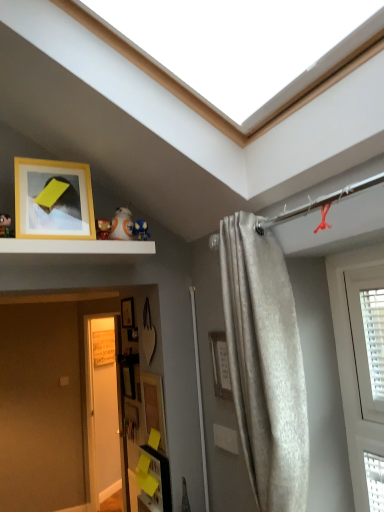
Measure the distance between wooden picture frame at lower center, which is the 2th picture frame from back to front, and camera.

They are 3.20 meters apart.

What do you see at coordinates (5, 226) in the screenshot? The width and height of the screenshot is (384, 512). I see `matte black toy at upper left, marked as the fourth toy in a back-to-front arrangement` at bounding box center [5, 226].

The width and height of the screenshot is (384, 512). I want to click on white glossy door at lower left, so click(x=92, y=389).

From the image's perspective, is white glossy bb8 droid at upper center, which is the 3th toy from left to right, above or below white matte shelf at upper center?

white glossy bb8 droid at upper center, which is the 3th toy from left to right, is above white matte shelf at upper center.

Considering their positions, is white glossy bb8 droid at upper center, which is the 3th toy from left to right, located in front of or behind white matte shelf at upper center?

white glossy bb8 droid at upper center, which is the 3th toy from left to right, is positioned farther from the viewer than white matte shelf at upper center.

Which is closer to the camera, (126, 233) or (82, 250)?

Point (126, 233).

Measure the distance from white glossy bb8 droid at upper center, which ranks as the 2th toy in right-to-left order, to white matte shelf at upper center.

The distance of white glossy bb8 droid at upper center, which ranks as the 2th toy in right-to-left order, from white matte shelf at upper center is 5.23 inches.

I want to click on picture frame above the wooden picture frame at center, placed as the fourth picture frame when sorted from front to back (from a real-world perspective), so click(x=53, y=200).

Is yellow matte picture frame at upper left, the first picture frame viewed from the front, inside or outside of wooden picture frame at center, the third picture frame from the bottom?

yellow matte picture frame at upper left, the first picture frame viewed from the front, cannot be found inside wooden picture frame at center, the third picture frame from the bottom.

What's the angular difference between yellow matte picture frame at upper left, the first picture frame viewed from the front, and wooden picture frame at center, placed as the fourth picture frame when sorted from front to back,'s facing directions?

The angle between the facing direction of yellow matte picture frame at upper left, the first picture frame viewed from the front, and the facing direction of wooden picture frame at center, placed as the fourth picture frame when sorted from front to back, is 88.5 degrees.

Between yellow matte picture frame at upper left, which ranks as the fourth picture frame in bottom-to-top order, and wooden picture frame at center, placed as the fourth picture frame when sorted from front to back, which one has less height?

With less height is wooden picture frame at center, placed as the fourth picture frame when sorted from front to back.

From a real-world perspective, which object stands above the other?

white glossy bb8 droid at upper center, which ranks as the 2th toy in right-to-left order, from a real-world perspective.

Is matte blue plush at upper center, marked as the 4th toy in a front-to-back arrangement, looking in the opposite direction of white glossy bb8 droid at upper center, which is the 3th toy from left to right?

matte blue plush at upper center, marked as the 4th toy in a front-to-back arrangement, is not turned away from white glossy bb8 droid at upper center, which is the 3th toy from left to right.

Who is smaller, matte blue plush at upper center, marked as the 4th toy in a front-to-back arrangement, or white glossy bb8 droid at upper center, which is the 3th toy from left to right?

With smaller size is matte blue plush at upper center, marked as the 4th toy in a front-to-back arrangement.

Is matte black toy at upper left, marked as the fourth toy in a back-to-front arrangement, oriented towards matte wooden picture frame at lower center, the 3th picture frame viewed from the top?

No, matte black toy at upper left, marked as the fourth toy in a back-to-front arrangement, is not aimed at matte wooden picture frame at lower center, the 3th picture frame viewed from the top.

Is matte black toy at upper left, which is the 1th toy from front to back, bigger than matte wooden picture frame at lower center, the 3th picture frame viewed from the top?

Incorrect, matte black toy at upper left, which is the 1th toy from front to back, is not larger than matte wooden picture frame at lower center, the 3th picture frame viewed from the top.

Does point (5, 217) appear closer or farther from the camera than point (145, 413)?

Point (5, 217) is positioned closer to the camera compared to point (145, 413).

From the picture: From the image's perspective, is matte black toy at upper left, the fourth toy positioned from the right, under matte wooden picture frame at lower center, which is the 2th picture frame in bottom-to-top order?

No.

Does point (0, 231) come behind point (50, 176)?

No, it is not.

Is matte black toy at upper left, which is the first toy from left to right, wider than yellow matte picture frame at upper left, the first picture frame viewed from the front?

Incorrect, the width of matte black toy at upper left, which is the first toy from left to right, does not surpass that of yellow matte picture frame at upper left, the first picture frame viewed from the front.

Based on the photo, do you think matte black toy at upper left, which is the first toy from left to right, is within yellow matte picture frame at upper left, the first picture frame viewed from the front, or outside of it?

matte black toy at upper left, which is the first toy from left to right, is located beyond the bounds of yellow matte picture frame at upper left, the first picture frame viewed from the front.

Between matte black toy at upper left, the fourth toy positioned from the right, and yellow matte picture frame at upper left, the fourth picture frame in the back-to-front sequence, which one has more height?

Standing taller between the two is yellow matte picture frame at upper left, the fourth picture frame in the back-to-front sequence.

Can you confirm if wooden picture frame at lower center, the 1th picture frame positioned from the bottom, is smaller than matte blue plush at upper center, the fourth toy from the left?

Actually, wooden picture frame at lower center, the 1th picture frame positioned from the bottom, might be larger than matte blue plush at upper center, the fourth toy from the left.

Is wooden picture frame at lower center, the 1th picture frame positioned from the bottom, positioned in front of matte blue plush at upper center, which is the 1th toy from back to front?

No, it is not.

From the image's perspective, relative to matte blue plush at upper center, the fourth toy from the left, is wooden picture frame at lower center, which is the 2th picture frame from back to front, above or below?

wooden picture frame at lower center, which is the 2th picture frame from back to front, is below matte blue plush at upper center, the fourth toy from the left.

Considering the relative sizes of wooden picture frame at lower center, arranged as the 4th picture frame when viewed from the top, and matte blue plush at upper center, which is the 1th toy from back to front, in the image provided, is wooden picture frame at lower center, arranged as the 4th picture frame when viewed from the top, thinner than matte blue plush at upper center, which is the 1th toy from back to front,?

Yes.

Is wooden picture frame at center, which ranks as the 2th picture frame in top-to-bottom order, thinner than matte wooden picture frame at lower center, acting as the 3th picture frame starting from the back?

Incorrect, the width of wooden picture frame at center, which ranks as the 2th picture frame in top-to-bottom order, is not less than that of matte wooden picture frame at lower center, acting as the 3th picture frame starting from the back.

How far apart are wooden picture frame at center, placed as the fourth picture frame when sorted from front to back, and matte wooden picture frame at lower center, acting as the 3th picture frame starting from the back?

They are 36.36 inches apart.

Can you confirm if wooden picture frame at center, which appears as the 1th picture frame when viewed from the back, is smaller than matte wooden picture frame at lower center, the 2th picture frame viewed from the front?

Yes.

Is wooden picture frame at center, the third picture frame from the bottom, next to matte wooden picture frame at lower center, the 3th picture frame viewed from the top, and touching it?

No, wooden picture frame at center, the third picture frame from the bottom, is not making contact with matte wooden picture frame at lower center, the 3th picture frame viewed from the top.

You are a GUI agent. You are given a task and a screenshot of the screen. Output one action in this format:
    pyautogui.click(x=<x>, y=<y>)
    Task: Click on the shelf below the white glossy bb8 droid at upper center, which is the 3th toy from left to right (from a real-world perspective)
    The height and width of the screenshot is (512, 384).
    Given the screenshot: What is the action you would take?
    pyautogui.click(x=76, y=247)

Locate an element on the screen. This screenshot has height=512, width=384. picture frame located on the left of yellow matte picture frame at upper left, which ranks as the fourth picture frame in bottom-to-top order is located at coordinates click(127, 313).

Considering their positions, is wooden picture frame at center, the third picture frame from the bottom, positioned closer to white glossy bb8 droid at upper center, the 3th toy when ordered from front to back, than matte black toy at upper left, the fourth toy positioned from the right?

The object closer to white glossy bb8 droid at upper center, the 3th toy when ordered from front to back, is matte black toy at upper left, the fourth toy positioned from the right.

From the image, which object appears to be farther from white glossy bb8 droid at upper center, which ranks as the 2th toy in right-to-left order, matte black toy at upper left, which is the first toy from left to right, or satin beige curtain at right?

satin beige curtain at right is further to white glossy bb8 droid at upper center, which ranks as the 2th toy in right-to-left order.

From the picture: Estimate the real-world distances between objects in this image. Which object is closer to matte blue plush at upper center, the 1th toy from the right, wooden picture frame at center, placed as the fourth picture frame when sorted from front to back, or satin beige curtain at right?

wooden picture frame at center, placed as the fourth picture frame when sorted from front to back.

When comparing their distances from white matte shelf at upper center, does satin beige curtain at right or white glossy door at lower left seem further?

Among the two, white glossy door at lower left is located further to white matte shelf at upper center.

From the image, which object appears to be farther from yellow matte picture frame at upper left, the first picture frame in the top-to-bottom sequence, wooden picture frame at lower center, the 1th picture frame positioned from the bottom, or satin beige curtain at right?

wooden picture frame at lower center, the 1th picture frame positioned from the bottom, lies further to yellow matte picture frame at upper left, the first picture frame in the top-to-bottom sequence, than the other object.

From the image, which object appears to be farther from satin beige curtain at right, wooden picture frame at center, placed as the fourth picture frame when sorted from front to back, or wooden picture frame at lower center, arranged as the 4th picture frame when viewed from the top?

Among the two, wooden picture frame at lower center, arranged as the 4th picture frame when viewed from the top, is located further to satin beige curtain at right.

Estimate the real-world distances between objects in this image. Which object is closer to white glossy door at lower left, white matte shelf at upper center or wooden picture frame at lower center, which is the 2th picture frame from back to front?

Among the two, wooden picture frame at lower center, which is the 2th picture frame from back to front, is located nearer to white glossy door at lower left.

Based on their spatial positions, is satin beige curtain at right or white glossy bb8 droid at upper center, the 2th toy viewed from the back, further from white matte shelf at upper center?

satin beige curtain at right is positioned further to the anchor white matte shelf at upper center.

Identify the location of toy between matte black toy at upper left, which is the first toy from left to right, and matte wooden picture frame at lower center, the 2th picture frame viewed from the front, in the up-down direction. This screenshot has width=384, height=512. (103, 229).

The height and width of the screenshot is (512, 384). Find the location of `shelf positioned between satin beige curtain at right and white glossy door at lower left from near to far`. shelf positioned between satin beige curtain at right and white glossy door at lower left from near to far is located at coordinates (76, 247).

The height and width of the screenshot is (512, 384). I want to click on picture frame located between white glossy bb8 droid at upper center, which is the 3th toy from left to right, and wooden picture frame at lower center, the third picture frame from the front, in the depth direction, so click(154, 406).

At what (x,y) coordinates should I click in order to perform the action: click on shelf between matte blue plush at upper center, which is the 1th toy from back to front, and matte wooden picture frame at lower center, the 3th picture frame viewed from the top, in the up-down direction. Please return your answer as a coordinate pair (x, y). The image size is (384, 512). Looking at the image, I should click on (76, 247).